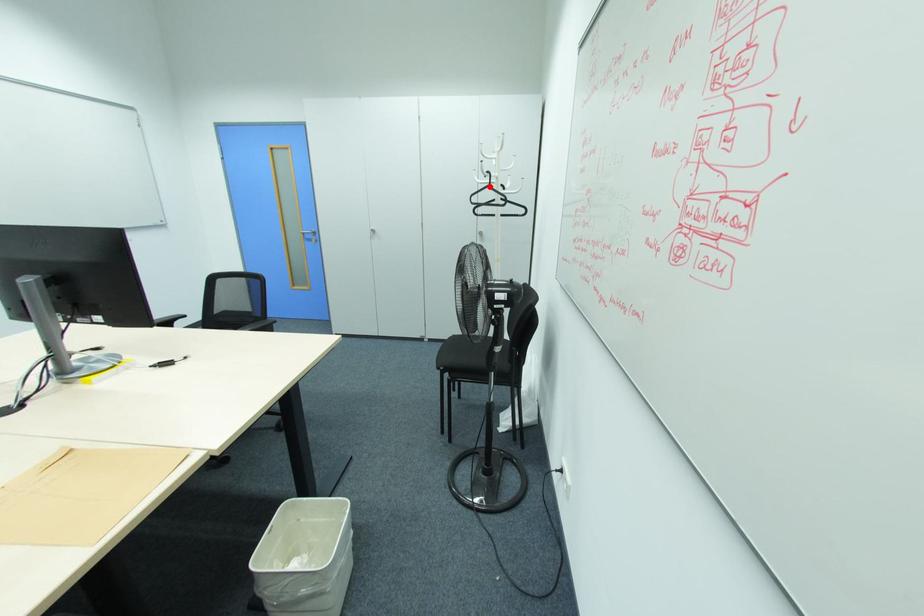
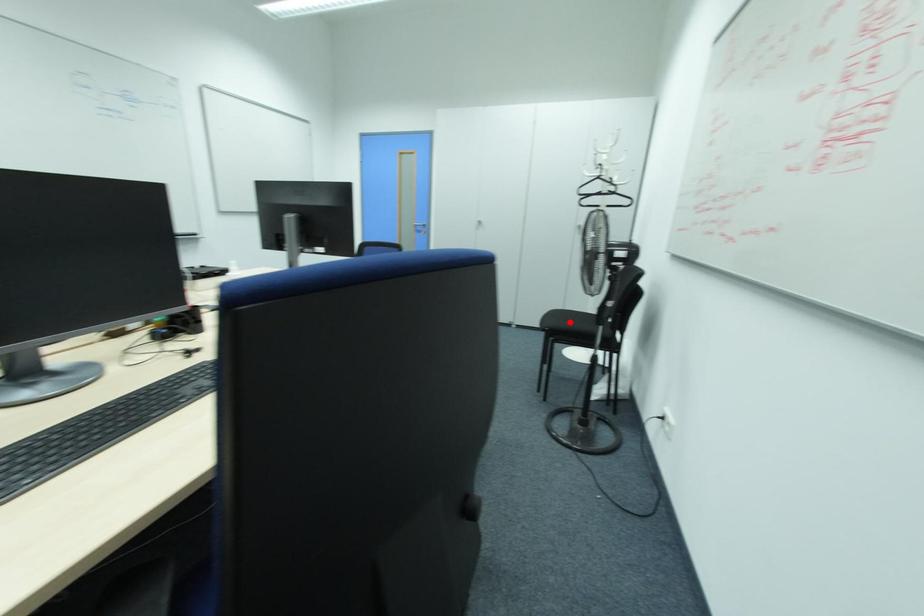
I am providing you with two images of the same scene from different viewpoints. A red point is marked on the first image and another point is marked on the second image. Do the highlighted points in image1 and image2 indicate the same real-world spot?

No